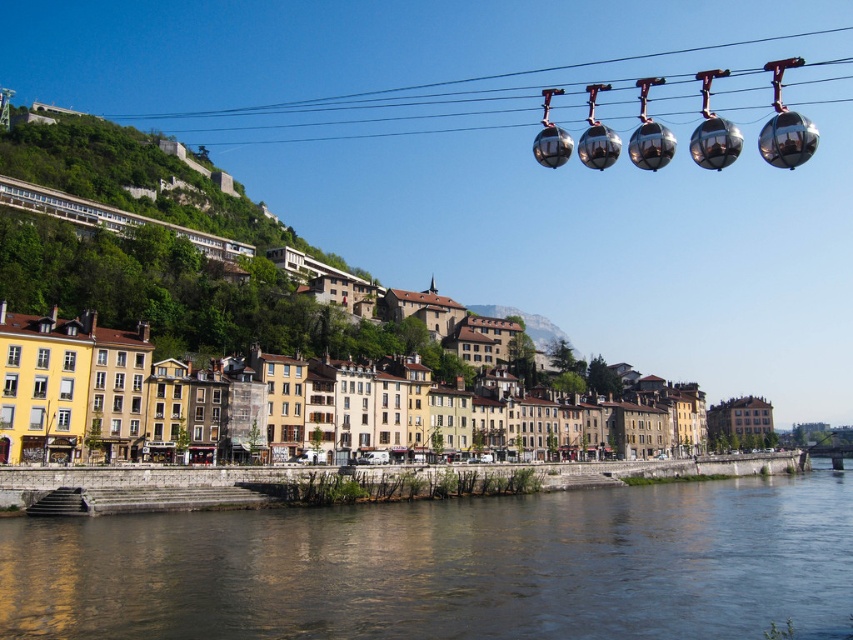
You are standing at the point with coordinates (450, 566) in the riverside scene. What type of surface are you currently standing on?

The point at (450, 566) corresponds to transparent water at lower center, so you are standing on water.